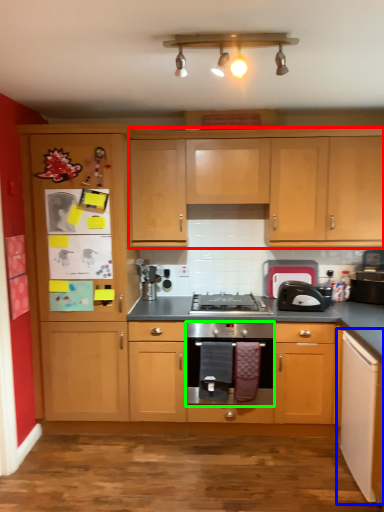
Question: Considering the real-world distances, which object is farthest from cabinetry (highlighted by a red box)? cabinetry (highlighted by a blue box) or oven (highlighted by a green box)?

Choices:
 (A) cabinetry
 (B) oven

Answer: (A)